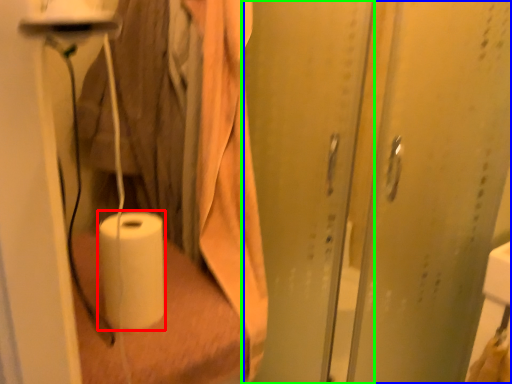
Question: Which object is positioned farthest from paper towel (highlighted by a red box)? Select from screen door (highlighted by a blue box) and screen door (highlighted by a green box).

Choices:
 (A) screen door
 (B) screen door

Answer: (A)